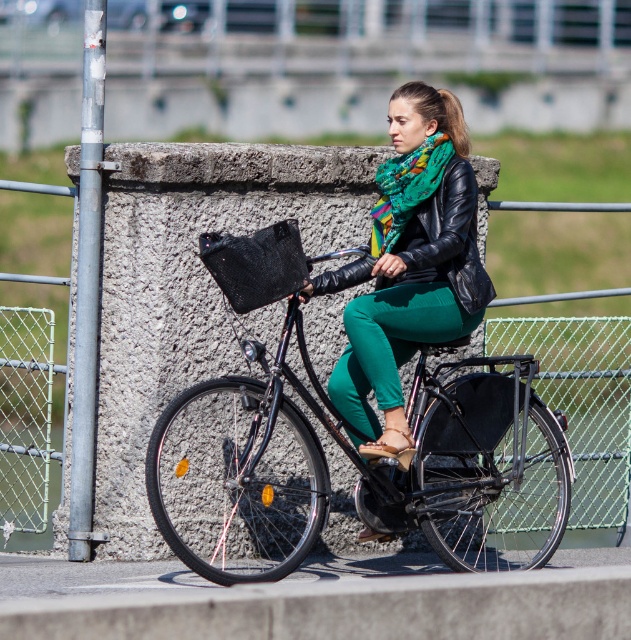
You are a photographer trying to capture the woman and her accessories. Given that the shiny black bicycle at center and the green matte scarf at center are both in focus, which object would appear wider in the photo?

The shiny black bicycle at center would appear wider in the photo since its width is larger than that of the green matte scarf at center.